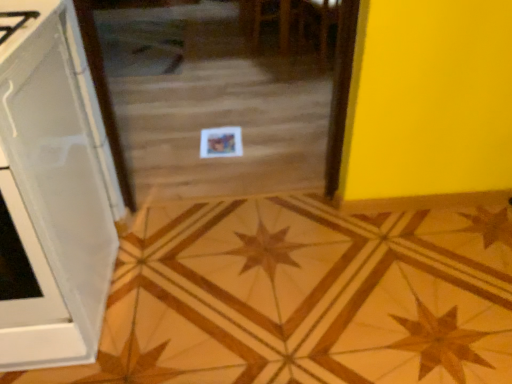
Question: Is transparent glass door at center completely or partially outside of white glossy cabinet at left?

Choices:
 (A) yes
 (B) no

Answer: (A)

Question: Considering the relative sizes of transparent glass door at center and white glossy cabinet at left in the image provided, is transparent glass door at center taller than white glossy cabinet at left?

Choices:
 (A) yes
 (B) no

Answer: (B)

Question: Is transparent glass door at center to the right of white glossy cabinet at left from the viewer's perspective?

Choices:
 (A) no
 (B) yes

Answer: (B)

Question: Is transparent glass door at center positioned in front of white glossy cabinet at left?

Choices:
 (A) yes
 (B) no

Answer: (B)

Question: Is transparent glass door at center behind white glossy cabinet at left?

Choices:
 (A) no
 (B) yes

Answer: (B)

Question: From a real-world perspective, relative to wooden star at center, is transparent glass door at center vertically above or below?

Choices:
 (A) below
 (B) above

Answer: (B)

Question: From the image's perspective, is transparent glass door at center positioned above or below wooden star at center?

Choices:
 (A) above
 (B) below

Answer: (A)

Question: Is transparent glass door at center inside the boundaries of wooden star at center, or outside?

Choices:
 (A) outside
 (B) inside

Answer: (A)

Question: In the image, is transparent glass door at center on the left side or the right side of wooden star at center?

Choices:
 (A) left
 (B) right

Answer: (A)

Question: Looking at the image, does transparent glass door at center seem bigger or smaller compared to white glossy cabinet at left?

Choices:
 (A) small
 (B) big

Answer: (B)

Question: Is transparent glass door at center situated inside white glossy cabinet at left or outside?

Choices:
 (A) inside
 (B) outside

Answer: (B)

Question: From a real-world perspective, is transparent glass door at center positioned above or below white glossy cabinet at left?

Choices:
 (A) below
 (B) above

Answer: (A)

Question: Does point (110, 102) appear closer or farther from the camera than point (82, 187)?

Choices:
 (A) farther
 (B) closer

Answer: (A)

Question: In the image, is wooden star at center positioned in front of or behind white glossy cabinet at left?

Choices:
 (A) behind
 (B) front

Answer: (A)

Question: From the image's perspective, is wooden star at center located above or below white glossy cabinet at left?

Choices:
 (A) below
 (B) above

Answer: (A)